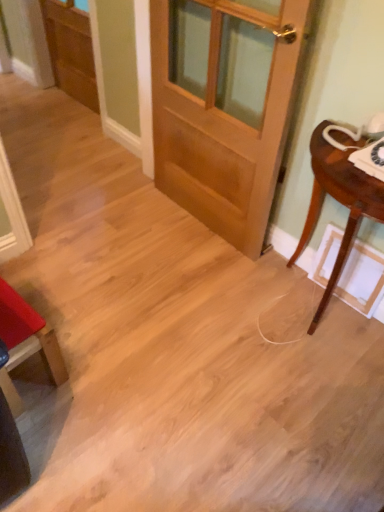
Where is `vacant space in front of light brown wood door at center`? vacant space in front of light brown wood door at center is located at coordinates (183, 281).